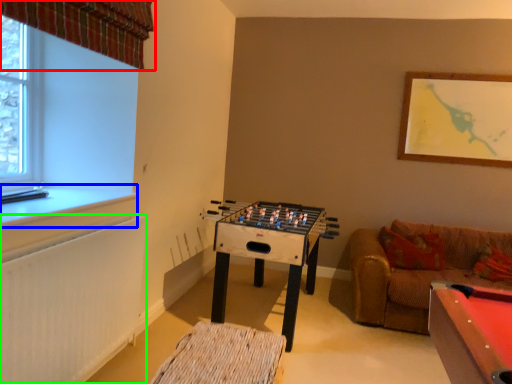
Question: Which object is the closest to the curtain (highlighted by a red box)? Choose among these: window sill (highlighted by a blue box) or radiator (highlighted by a green box).

Choices:
 (A) window sill
 (B) radiator

Answer: (A)